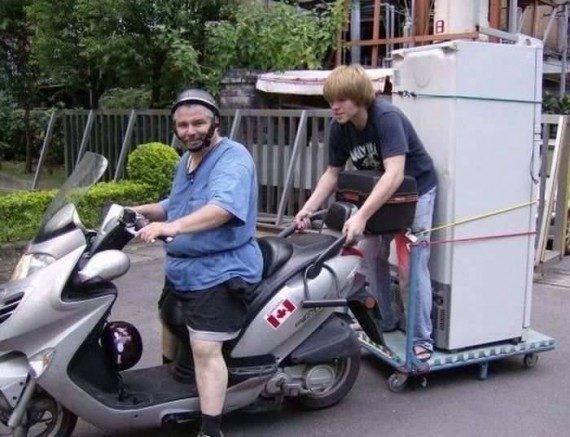
Identify the location of appliance. The height and width of the screenshot is (437, 570). tap(480, 168).